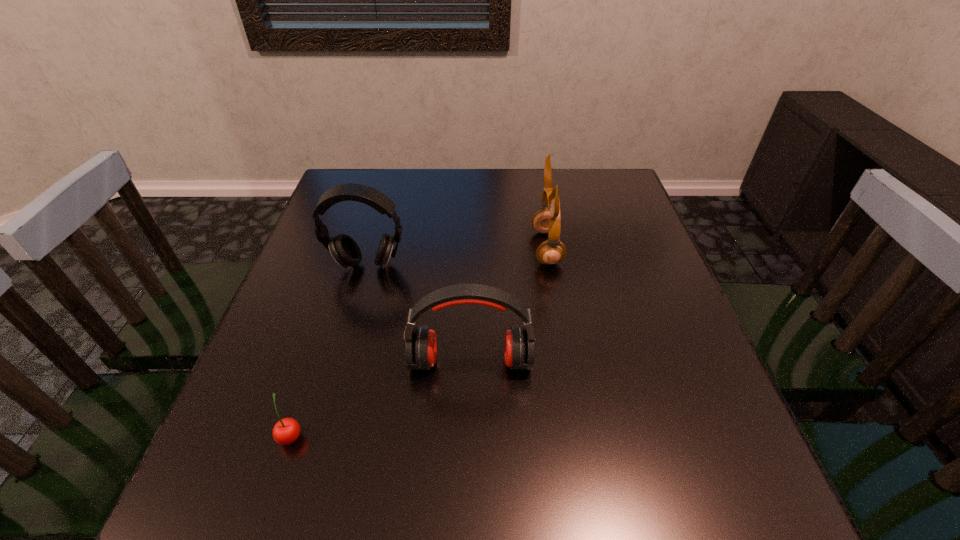
Identify the location of the rightmost earphone. The height and width of the screenshot is (540, 960). (548, 220).

Where is `the leftmost earphone`? The height and width of the screenshot is (540, 960). the leftmost earphone is located at coordinates (346, 252).

At what (x,y) coordinates should I click in order to perform the action: click on the second object from right to left. Please return your answer as a coordinate pair (x, y). Looking at the image, I should click on (421, 344).

The width and height of the screenshot is (960, 540). I want to click on the second earphone from left to right, so click(421, 344).

Identify the location of the shortest object. (286, 431).

This screenshot has height=540, width=960. I want to click on cherry, so click(286, 431).

Identify the location of vacant position located on the front-facing side of the rightmost earphone. (509, 248).

This screenshot has width=960, height=540. In order to click on free space located on the front-facing side of the rightmost earphone in this screenshot , I will do `click(405, 248)`.

Locate an element on the screen. The width and height of the screenshot is (960, 540). free point located on the front-facing side of the rightmost earphone is located at coordinates (397, 248).

The width and height of the screenshot is (960, 540). Identify the location of vacant space located 0.270m on the ear cups of the leftmost earphone. click(337, 374).